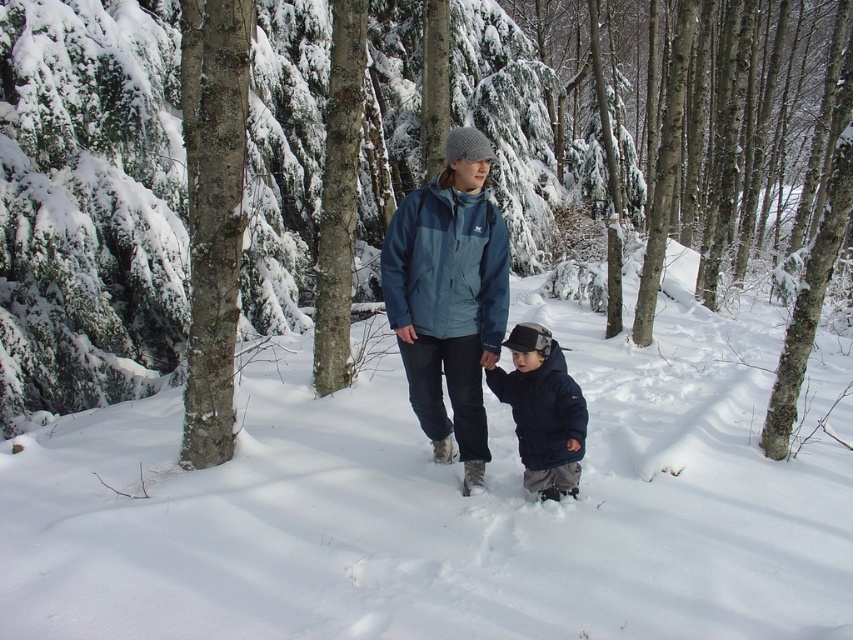
You are standing in the snowy forest scene and want to touch the smooth bark tree at center and the navy blue fleece jacket at center. Which object can you reach first as you move forward?

The smooth bark tree at center is closer to you than the navy blue fleece jacket at center, so you can reach it first.

You are planning to build a snowman using the white fluffy snow at center. However, you notice a brown rough tree trunk at center nearby. Which object is bigger in size and might block your path?

The brown rough tree trunk at center is larger in size than the white fluffy snow at center, so it might block your path.

You are a photographer trying to capture the scene with a wide angle lens. You want to ensure both the brown rough tree trunk at center and the matte blue jacket at center are in focus. Given that the tree trunk is wider, will you need to adjust your focus differently compared to if the tree trunk were narrower?

The brown rough tree trunk at center is wider than the matte blue jacket at center. To keep both in focus, you should focus on the tree trunk first since it is wider and occupies more space in the frame, then adjust the aperture to ensure the matte blue jacket remains sharp.